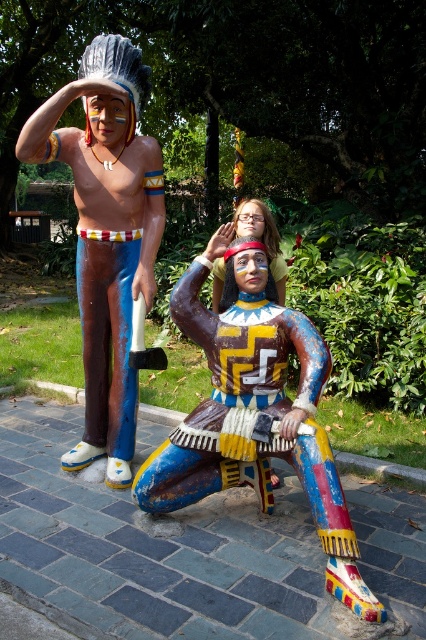
Question: Does painted wood figure at center appear on the left side of matte painted figure at left?

Choices:
 (A) yes
 (B) no

Answer: (B)

Question: Is painted wood figure at center bigger than matte painted figure at left?

Choices:
 (A) yes
 (B) no

Answer: (B)

Question: Can you confirm if painted wood figure at center is positioned above matte painted figure at left?

Choices:
 (A) yes
 (B) no

Answer: (B)

Question: Among these points, which one is nearest to the camera?

Choices:
 (A) (221, 364)
 (B) (46, 145)

Answer: (A)

Question: Which of the following is the farthest from the observer?

Choices:
 (A) (247, 250)
 (B) (150, 253)

Answer: (B)